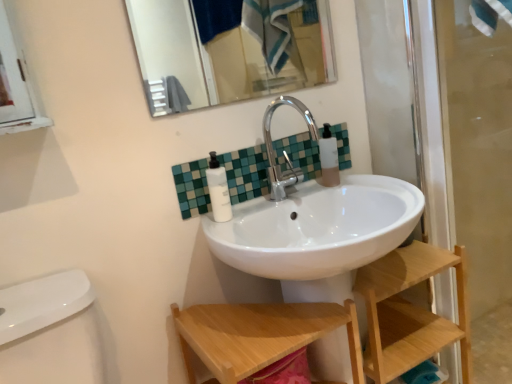
At what (x,y) coordinates should I click in order to perform the action: click on vacant area that lies to the right of white matte pump bottle at center, arranged as the second toiletry when viewed from the back. Please return your answer as a coordinate pair (x, y). This screenshot has height=384, width=512. Looking at the image, I should click on (278, 206).